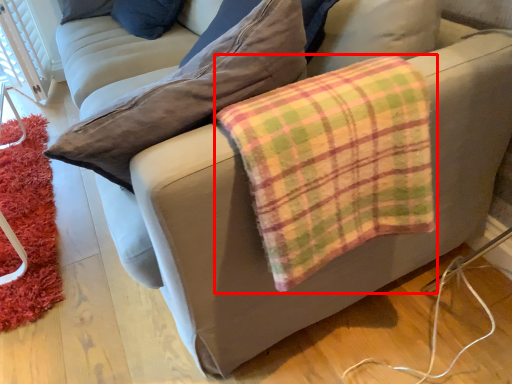
Question: From the image, what is the correct spatial relationship of flannel (annotated by the red box) in relation to mat?

Choices:
 (A) left
 (B) right

Answer: (B)